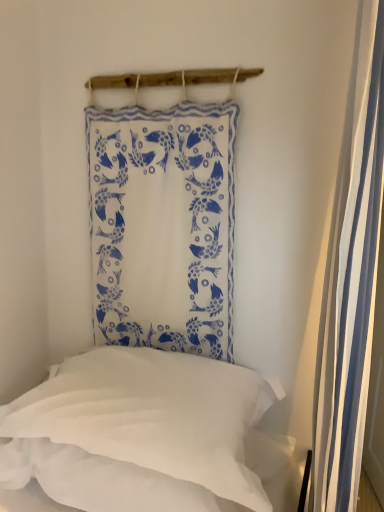
Question: Would you say white striped fabric at right is to the left or to the right of white soft pillow at lower left in the picture?

Choices:
 (A) left
 (B) right

Answer: (B)

Question: Choose the correct answer: Is white striped fabric at right inside white soft pillow at lower left or outside it?

Choices:
 (A) outside
 (B) inside

Answer: (A)

Question: Based on their relative distances, which object is farther from the white soft pillow at lower left?

Choices:
 (A) white striped fabric at right
 (B) white fabric with blue fish pattern at upper center

Answer: (A)

Question: Which is nearer to the white soft pillow at lower left?

Choices:
 (A) white fabric with blue fish pattern at upper center
 (B) white striped fabric at right

Answer: (A)